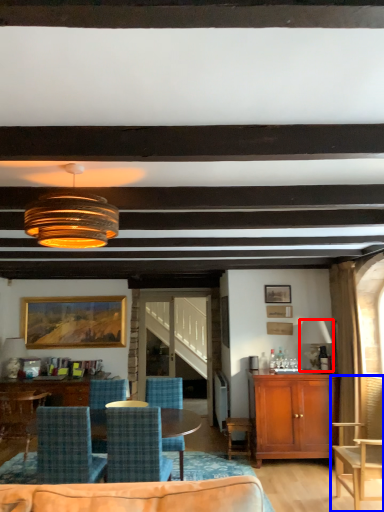
Question: Which point is further to the camera, lamp (highlighted by a red box) or chair (highlighted by a blue box)?

Choices:
 (A) lamp
 (B) chair

Answer: (A)